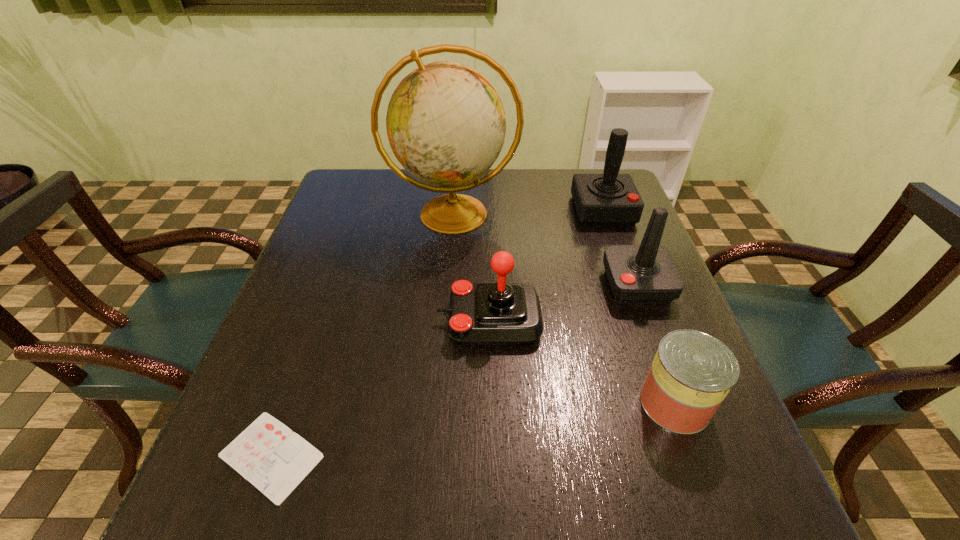
Where is `free space located 0.260m on the back of the can`? The height and width of the screenshot is (540, 960). free space located 0.260m on the back of the can is located at coordinates (631, 281).

The image size is (960, 540). Find the location of `vacant space located 0.250m on the right of the shortest object`. vacant space located 0.250m on the right of the shortest object is located at coordinates (476, 456).

The height and width of the screenshot is (540, 960). In order to click on globe at the far edge in this screenshot , I will do `click(446, 125)`.

The height and width of the screenshot is (540, 960). Identify the location of joystick positioned at the far edge. (610, 198).

Find the location of a particular element. The height and width of the screenshot is (540, 960). object positioned at the near edge is located at coordinates (268, 454).

You are a GUI agent. You are given a task and a screenshot of the screen. Output one action in this format:
    pyautogui.click(x=<x>, y=<y>)
    Task: Click on the object located in the left edge section of the desktop
    The width and height of the screenshot is (960, 540).
    Given the screenshot: What is the action you would take?
    pyautogui.click(x=268, y=454)

Where is `can at the right edge`? This screenshot has height=540, width=960. can at the right edge is located at coordinates (692, 372).

Where is `object present at the near left corner`? The image size is (960, 540). object present at the near left corner is located at coordinates (268, 454).

You are a GUI agent. You are given a task and a screenshot of the screen. Output one action in this format:
    pyautogui.click(x=<x>, y=<y>)
    Task: Click on the object present at the far right corner
    
    Given the screenshot: What is the action you would take?
    pyautogui.click(x=610, y=198)

I want to click on vacant position at the far edge of the desktop, so click(549, 199).